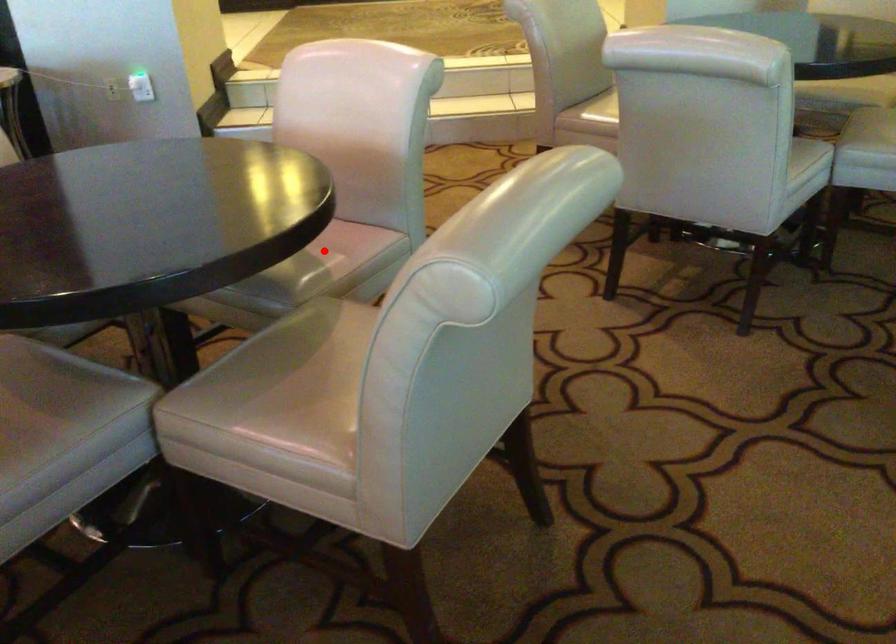
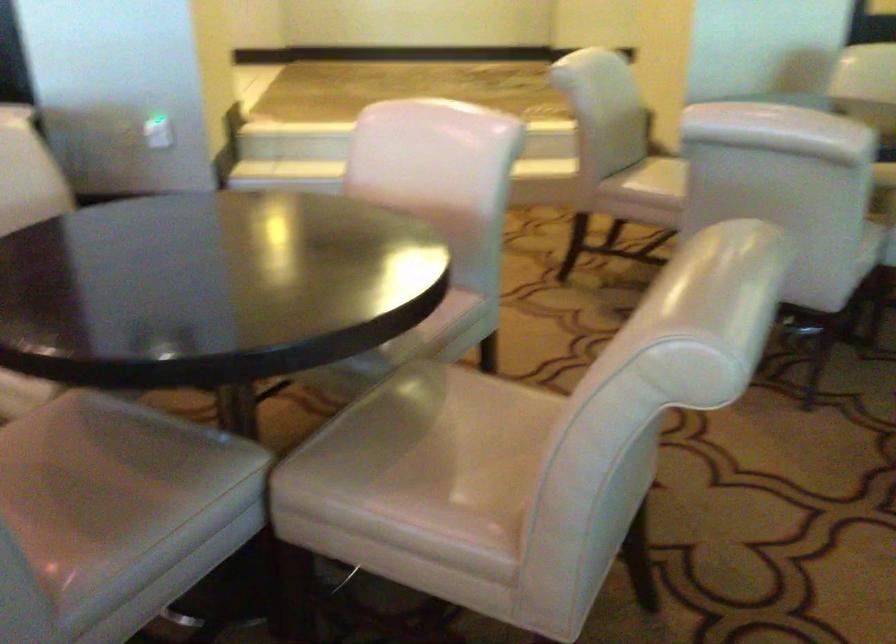
Question: I am providing you with two images of the same scene from different viewpoints. A red point is marked on the first image. Is the red point's position out of view in image 2?

Choices:
 (A) Yes
 (B) No

Answer: (A)